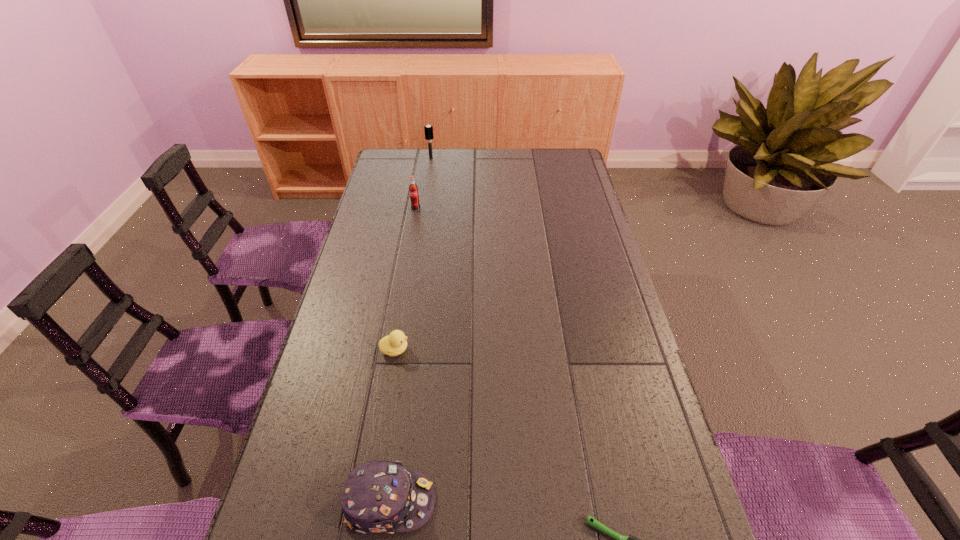
This screenshot has height=540, width=960. I want to click on the farther hairbrush, so click(x=428, y=129).

Image resolution: width=960 pixels, height=540 pixels. In order to click on the farthest object in this screenshot , I will do `click(428, 129)`.

Identify the location of the second farthest object. (413, 189).

I want to click on headwear, so click(378, 497).

Image resolution: width=960 pixels, height=540 pixels. In order to click on duckling in this screenshot , I will do `click(394, 344)`.

You are a GUI agent. You are given a task and a screenshot of the screen. Output one action in this format:
    pyautogui.click(x=<x>, y=<y>)
    Task: Click on the third nearest object
    This screenshot has height=540, width=960.
    Given the screenshot: What is the action you would take?
    pyautogui.click(x=394, y=344)

What are the coordinates of `free space located on the left of the left hairbrush` in the screenshot? It's located at tap(412, 158).

This screenshot has height=540, width=960. What are the coordinates of `free location located on the label of the soda bottle` in the screenshot? It's located at (414, 219).

The height and width of the screenshot is (540, 960). I want to click on vacant point located 0.130m on the front-facing side of the headwear, so click(495, 502).

Where is `vacant space located 0.190m at the beak of the second shortest object`? The image size is (960, 540). vacant space located 0.190m at the beak of the second shortest object is located at coordinates (477, 349).